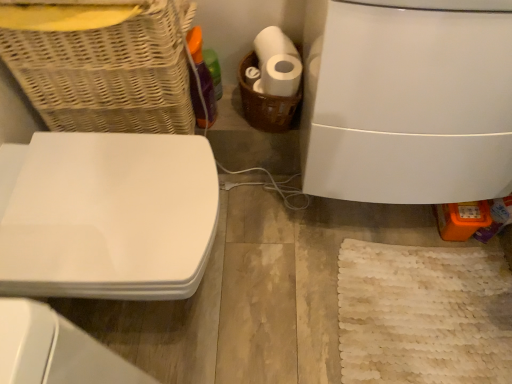
Question: In the image, is white glossy toilet at right on the left side or the right side of brown woven basket at center, positioned as the first basket in right-to-left order?

Choices:
 (A) left
 (B) right

Answer: (B)

Question: Is white glossy toilet at right bigger or smaller than brown woven basket at center, positioned as the first basket in right-to-left order?

Choices:
 (A) small
 (B) big

Answer: (B)

Question: Considering the real-world distances, which object is farthest from the white glossy toilet at right?

Choices:
 (A) translucent purple bottle at upper left
 (B) white glossy toilet seat at left
 (C) brown woven basket at center, which is the second basket in left-to-right order
 (D) woven wicker basket at upper left, which is counted as the second basket, starting from the right

Answer: (A)

Question: Which of these objects is positioned farthest from the brown woven basket at center, positioned as the first basket in right-to-left order?

Choices:
 (A) woven wicker basket at upper left, placed as the 1th basket when sorted from left to right
 (B) translucent purple bottle at upper left
 (C) white glossy toilet seat at left
 (D) white glossy toilet at right

Answer: (C)